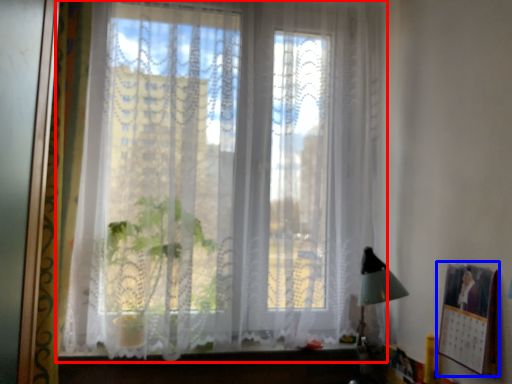
Question: Which object appears farthest to the camera in this image, window (highlighted by a red box) or picture frame (highlighted by a blue box)?

Choices:
 (A) window
 (B) picture frame

Answer: (A)